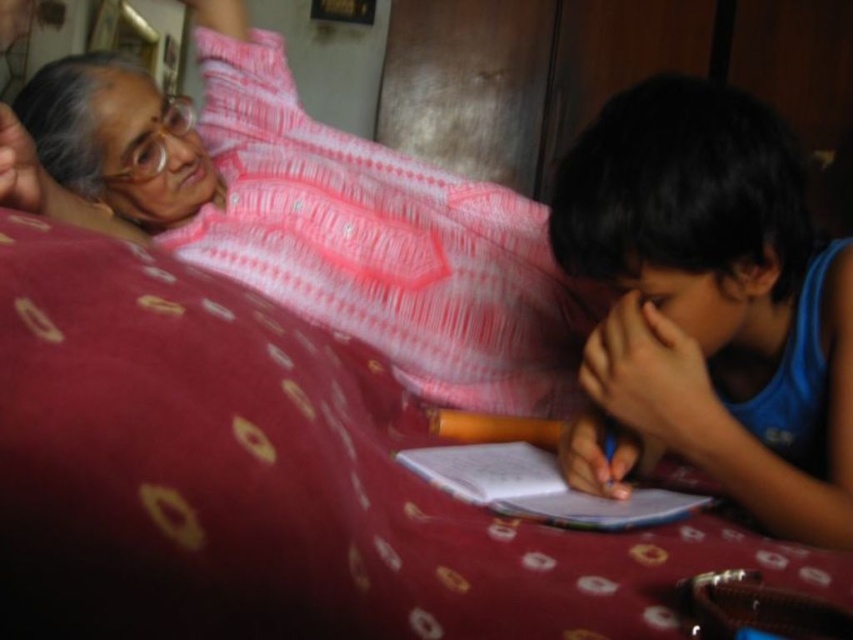
Question: Among these points, which one is nearest to the camera?

Choices:
 (A) (224, 182)
 (B) (99, 512)

Answer: (B)

Question: Which object is farther from the camera taking this photo?

Choices:
 (A) blue cotton shirt at right
 (B) pink textured kurta at upper left

Answer: (B)

Question: Considering the relative positions of patterned fabric bed at center and pink textured kurta at upper left in the image provided, where is patterned fabric bed at center located with respect to pink textured kurta at upper left?

Choices:
 (A) below
 (B) above

Answer: (A)

Question: Where is patterned fabric bed at center located in relation to blue cotton shirt at right in the image?

Choices:
 (A) below
 (B) above

Answer: (A)

Question: Is patterned fabric bed at center positioned in front of pink textured kurta at upper left?

Choices:
 (A) yes
 (B) no

Answer: (A)

Question: Among these objects, which one is farthest from the camera?

Choices:
 (A) pink textured kurta at upper left
 (B) blue cotton shirt at right
 (C) patterned fabric bed at center

Answer: (A)